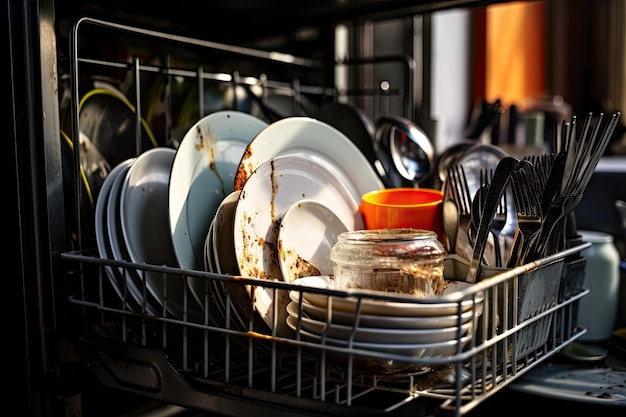
Identify the location of forks. (528, 235), (491, 232), (464, 218), (548, 198).